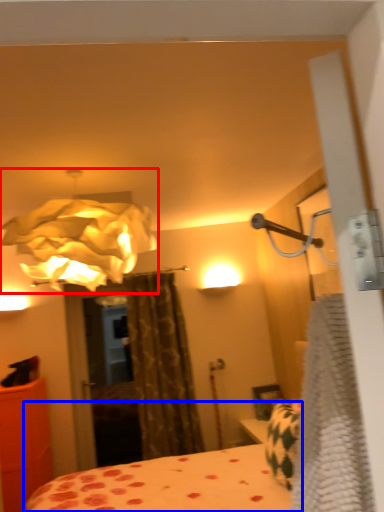
Question: Which of the following is the farthest to the observer, lamp (highlighted by a red box) or bed (highlighted by a blue box)?

Choices:
 (A) lamp
 (B) bed

Answer: (A)